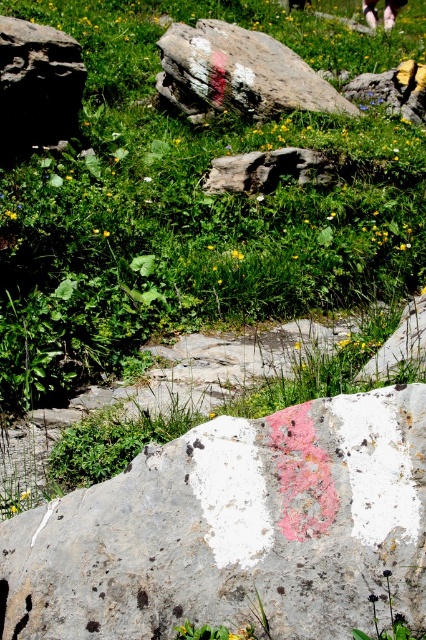
Question: Which of the following is the farthest from the observer?

Choices:
 (A) (172, 99)
 (B) (25, 106)
 (C) (210, 500)
 (D) (412, 61)

Answer: (D)

Question: Does white painted rock at center appear on the left side of white stone at upper center?

Choices:
 (A) no
 (B) yes

Answer: (B)

Question: Which point is closer to the camera?

Choices:
 (A) white stone at upper center
 (B) white painted rock at center
 (C) pink fabric pants at upper center

Answer: (B)

Question: Which of the following is the farthest from the observer?

Choices:
 (A) (17, 19)
 (B) (409, 81)
 (C) (201, 477)

Answer: (A)

Question: Does smooth gray rock at upper left have a larger size compared to pink fabric pants at upper center?

Choices:
 (A) yes
 (B) no

Answer: (A)

Question: Can you confirm if white textured rock at center is positioned below smooth gray rock at upper left?

Choices:
 (A) yes
 (B) no

Answer: (A)